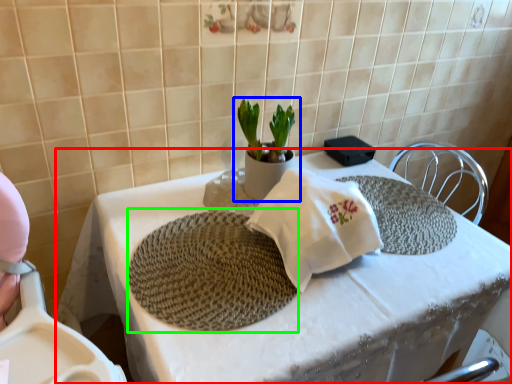
Question: Considering the real-world distances, which object is closest to table (highlighted by a red box)? houseplant (highlighted by a blue box) or mat (highlighted by a green box).

Choices:
 (A) houseplant
 (B) mat

Answer: (B)